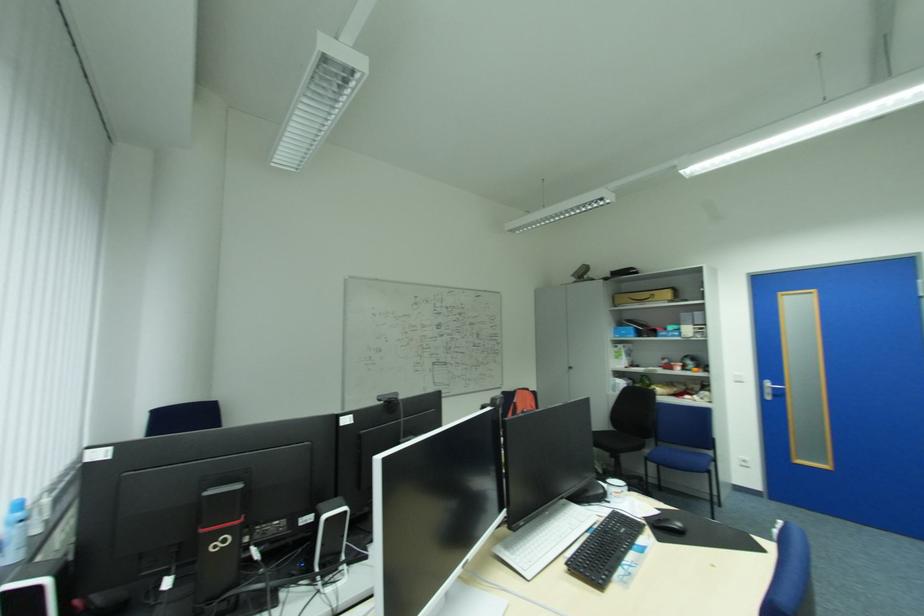
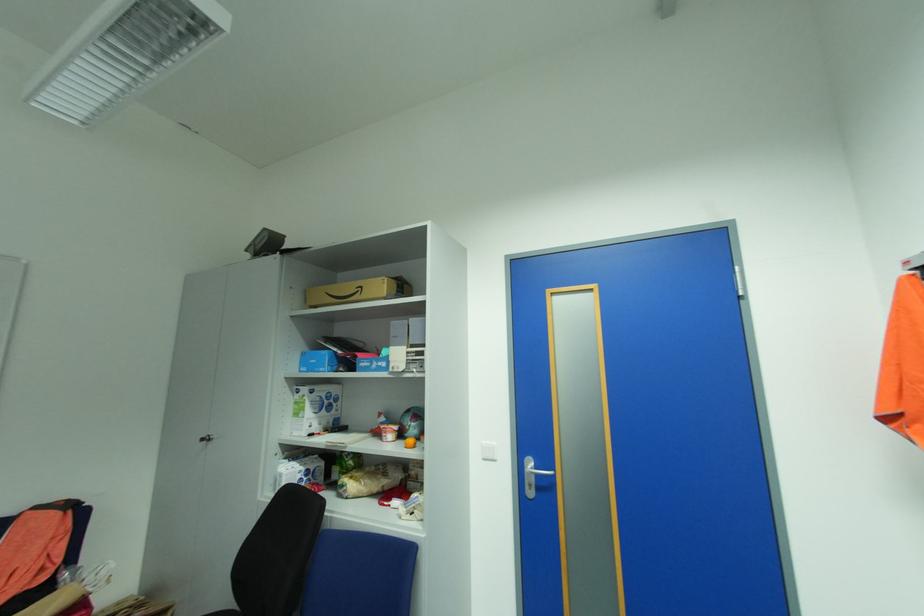
Where in the second image is the point corresponding to pixel 577 368 from the first image?

(213, 439)